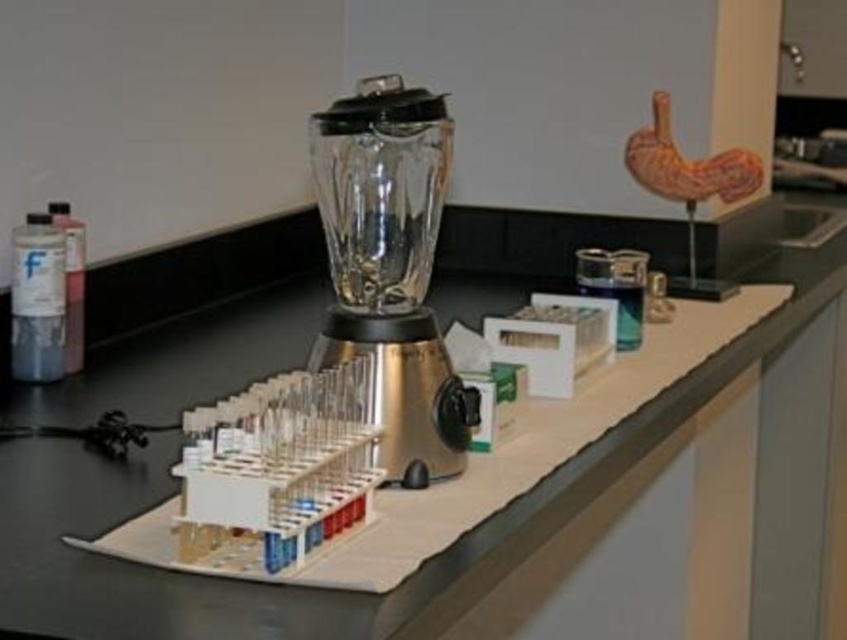
Question: Is the position of black plastic counter at center more distant than that of translucent glass blender at center?

Choices:
 (A) no
 (B) yes

Answer: (A)

Question: Is black plastic counter at center in front of translucent glass blender at center?

Choices:
 (A) yes
 (B) no

Answer: (A)

Question: Which point is closer to the camera taking this photo?

Choices:
 (A) pos(140,472)
 (B) pos(408,92)

Answer: (B)

Question: Does black plastic counter at center appear over translucent glass blender at center?

Choices:
 (A) no
 (B) yes

Answer: (B)

Question: Which object is farther from the camera taking this photo?

Choices:
 (A) black plastic counter at center
 (B) translucent glass blender at center

Answer: (B)